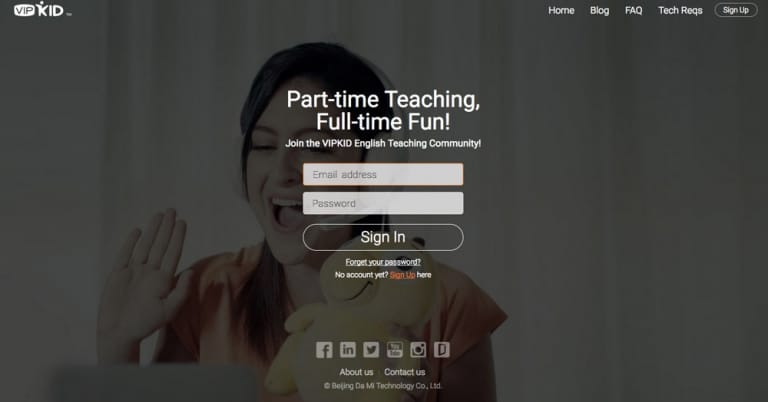
The height and width of the screenshot is (402, 768). Find the location of `stuffed animal`. stuffed animal is located at coordinates (365, 305).